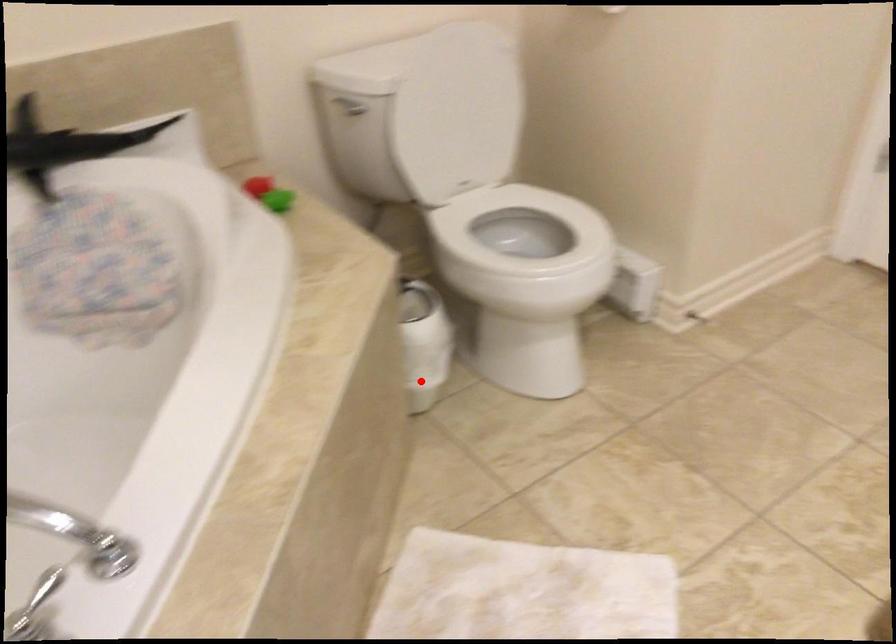
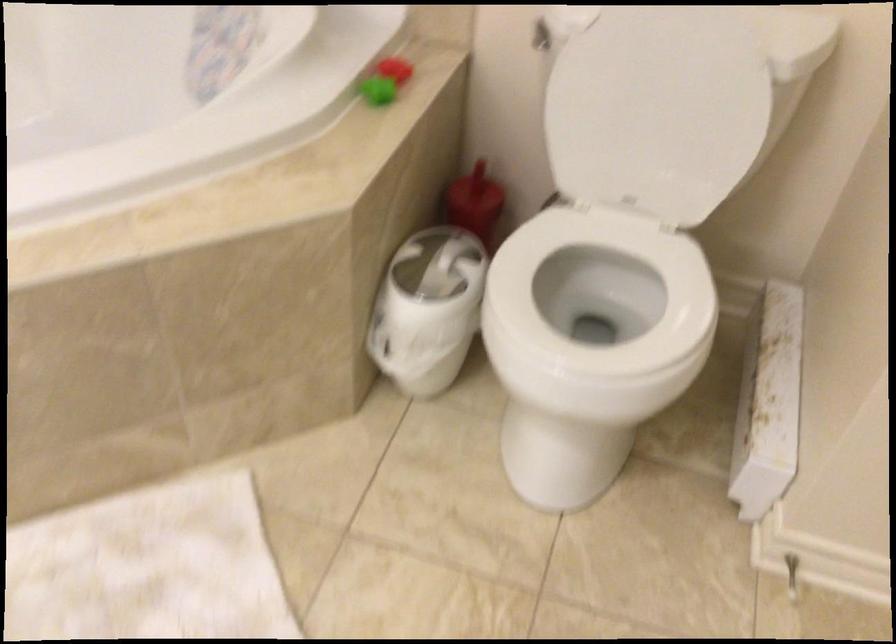
Question: A red point is marked in image1. In image2, is the corresponding 3D point closer to the camera or farther? Reply with the corresponding letter.

Choices:
 (A) The corresponding 3D point is closer.
 (B) The corresponding 3D point is farther.

Answer: (A)